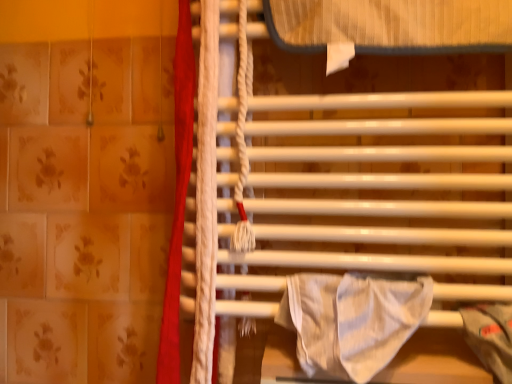
Question: Considering the relative positions of red fabric curtain at left and white striped fabric at center in the image provided, is red fabric curtain at left to the left or to the right of white striped fabric at center?

Choices:
 (A) right
 (B) left

Answer: (B)

Question: Does point (181, 13) appear closer or farther from the camera than point (311, 292)?

Choices:
 (A) closer
 (B) farther

Answer: (B)

Question: Which object is positioned farthest from the red fabric curtain at left?

Choices:
 (A) white glossy towel rack at center
 (B) white striped fabric at center

Answer: (B)

Question: Based on their relative distances, which object is farther from the red fabric curtain at left?

Choices:
 (A) white glossy towel rack at center
 (B) white striped fabric at center

Answer: (B)